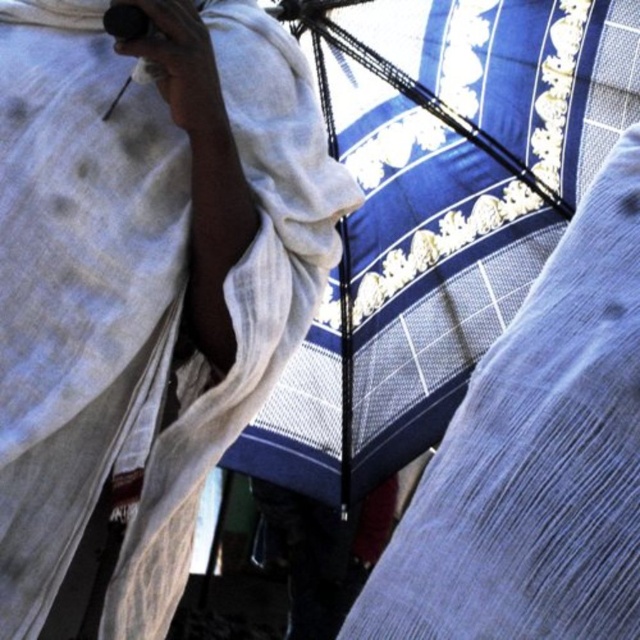
You are an anthropologist studying the spatial arrangement of cultural artifacts in a traditional ceremony. You observe the blue woven cloth at upper right in the scene. Can you determine its exact coordinates in the image?

The blue woven cloth at upper right is located at coordinates point (145, 282).

You are an interior designer assessing the width of fabrics for a project. You observe the blue woven cloth at upper right and the blue textured fabric at center in the image. Which fabric has a greater width?

The blue woven cloth at upper right might be wider than blue textured fabric at center according to the description.

You are an interior designer planning to place a 30 meter long sofa in a room. You see the blue woven cloth at upper right and the blue textured fabric at center in the room. Can the sofa fit between them?

The blue woven cloth at upper right and the blue textured fabric at center are 26.04 meters apart from each other. Since the sofa is 30 meters long, it cannot fit between them as the distance is shorter than the sofa.